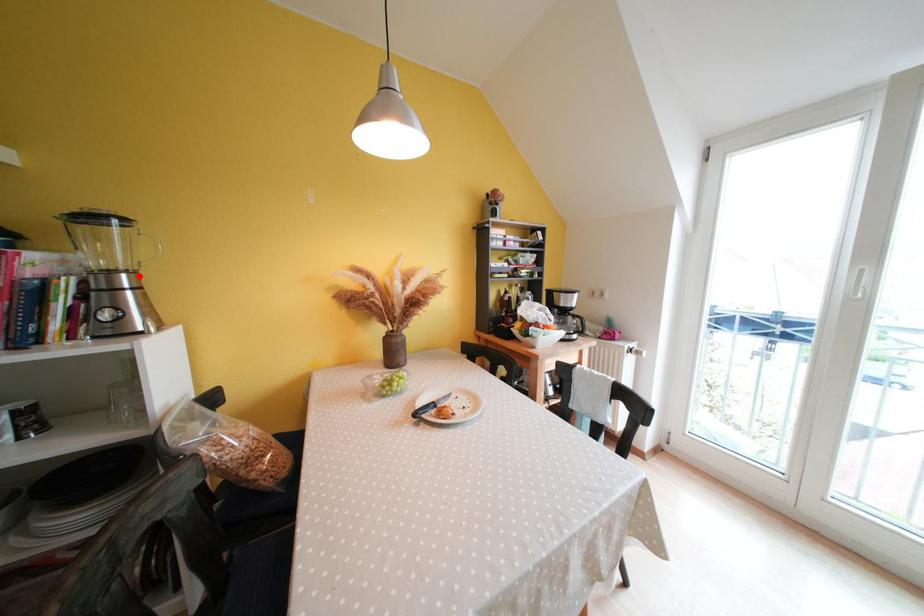
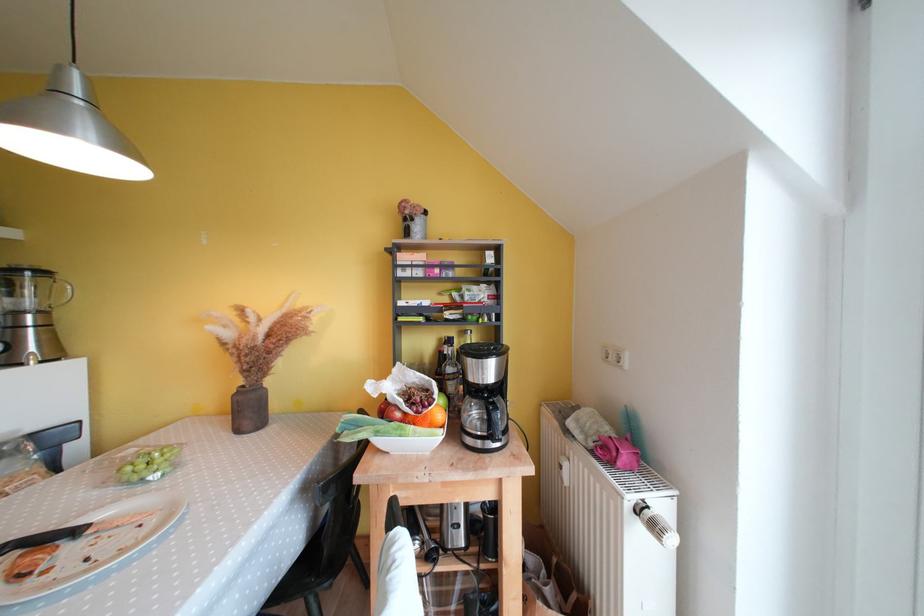
Locate, in the second image, the point that corresponds to the highlighted location in the first image.

(49, 315)